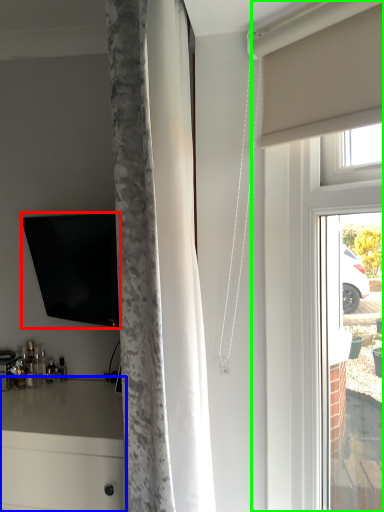
Question: Considering the real-world distances, which object is farthest from television (highlighted by a red box)? counter (highlighted by a blue box) or glass door (highlighted by a green box)?

Choices:
 (A) counter
 (B) glass door

Answer: (B)